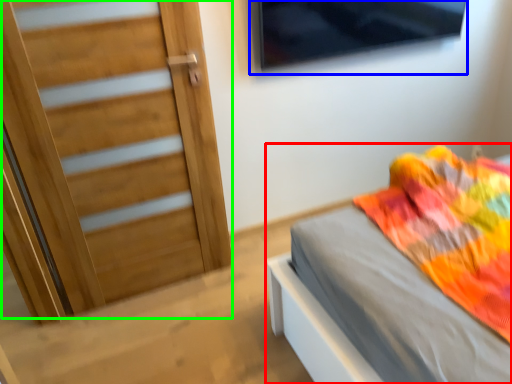
Question: Which object is the farthest from bed (highlighted by a red box)? Choose among these: window (highlighted by a blue box) or door (highlighted by a green box).

Choices:
 (A) window
 (B) door

Answer: (A)